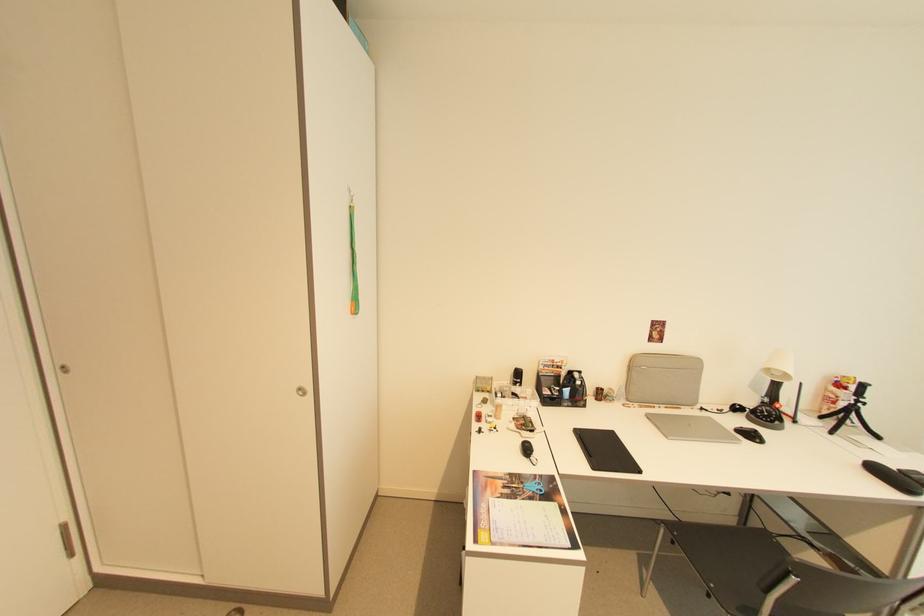
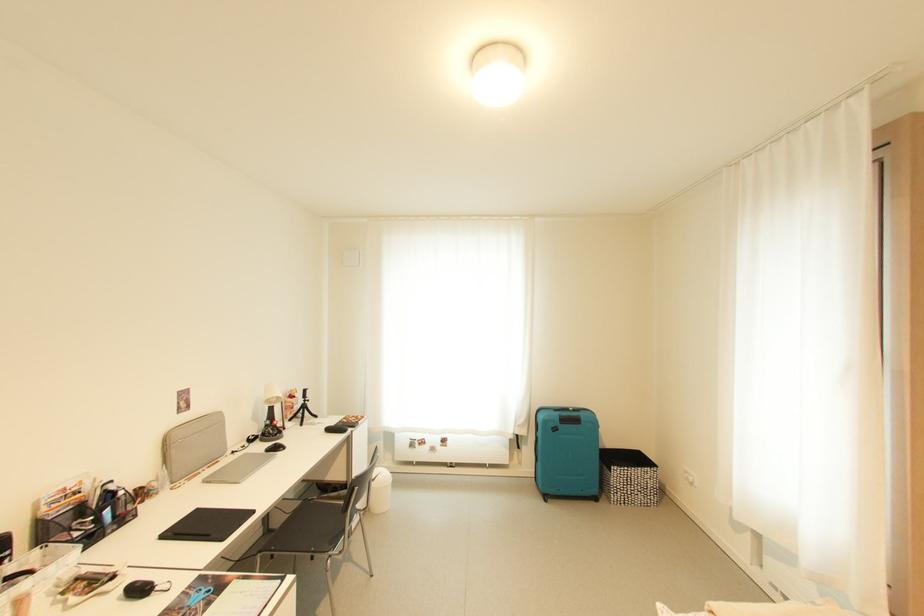
Question: The camera is either moving clockwise (left) or counter-clockwise (right) around the object. The first image is from the beginning of the video and the second image is from the end. Is the camera moving left or right when shooting the video?

Choices:
 (A) Left
 (B) Right

Answer: (A)